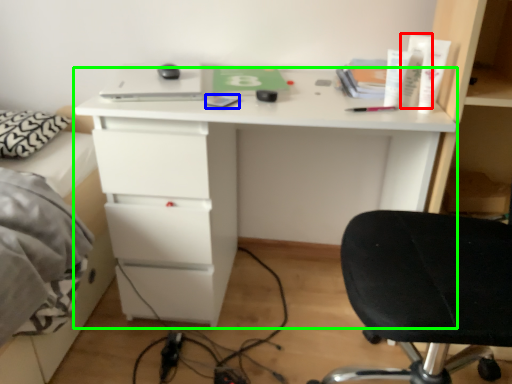
Question: Based on their relative distances, which object is nearer to toiletry (highlighted by a red box)? Choose from notepad (highlighted by a blue box) and desk (highlighted by a green box).

Choices:
 (A) notepad
 (B) desk

Answer: (A)